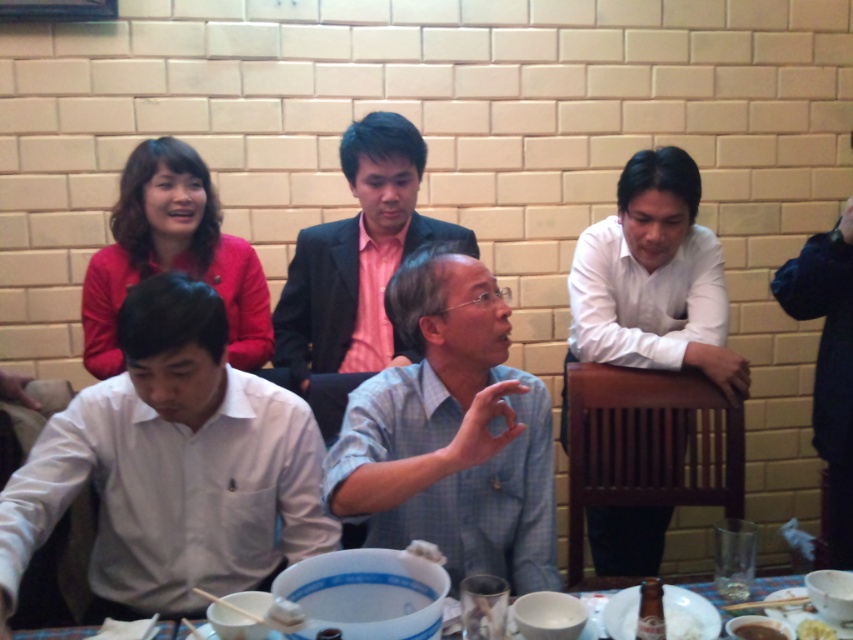
Can you confirm if brown matte bowl at lower center is positioned below yellow matte rice at lower right?

Yes, brown matte bowl at lower center is below yellow matte rice at lower right.

What do you see at coordinates (757, 632) in the screenshot? I see `brown matte bowl at lower center` at bounding box center [757, 632].

Where is `brown matte bowl at lower center`? brown matte bowl at lower center is located at coordinates (757, 632).

Who is more distant from viewer, (669, 150) or (816, 444)?

Point (816, 444)

Is white smooth shirt at right bigger than black leather jacket at right?

Yes.

Which is in front, point (608, 552) or point (838, 346)?

Point (838, 346)

The height and width of the screenshot is (640, 853). I want to click on white smooth shirt at right, so click(653, 282).

Can you confirm if black leather jacket at right is thinner than yellow matte rice at lower right?

Incorrect, black leather jacket at right's width is not less than yellow matte rice at lower right's.

Can you confirm if black leather jacket at right is bigger than yellow matte rice at lower right?

Yes.

Which is behind, point (839, 563) or point (820, 632)?

The point (839, 563) is more distant.

Where is `black leather jacket at right`? black leather jacket at right is located at coordinates (828, 364).